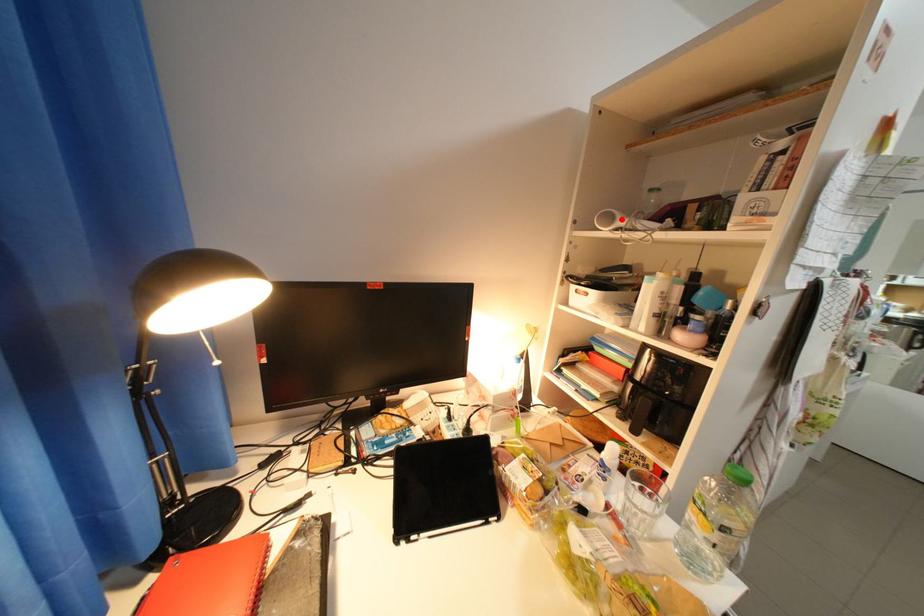
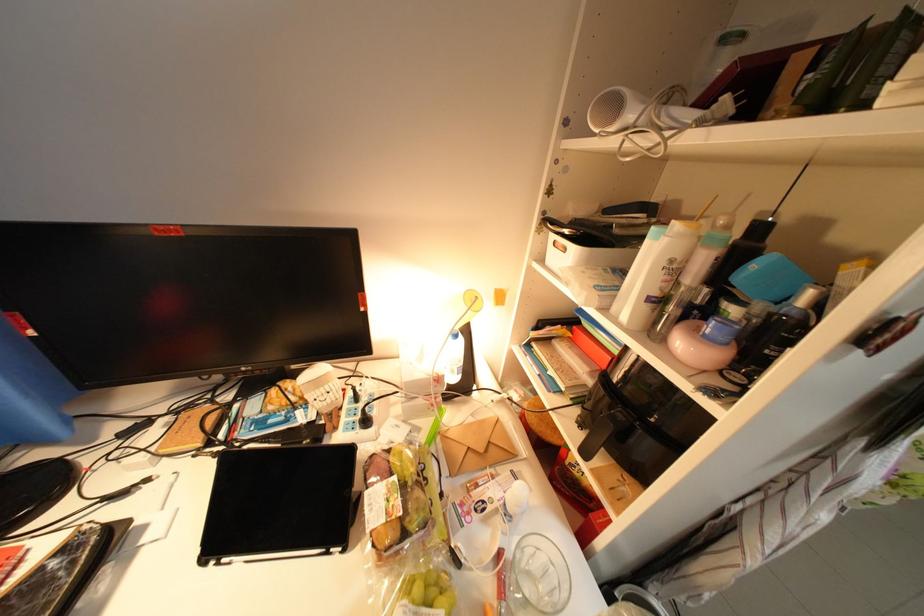
In the second image, find the point that corresponds to the highlighted location in the first image.

(625, 108)